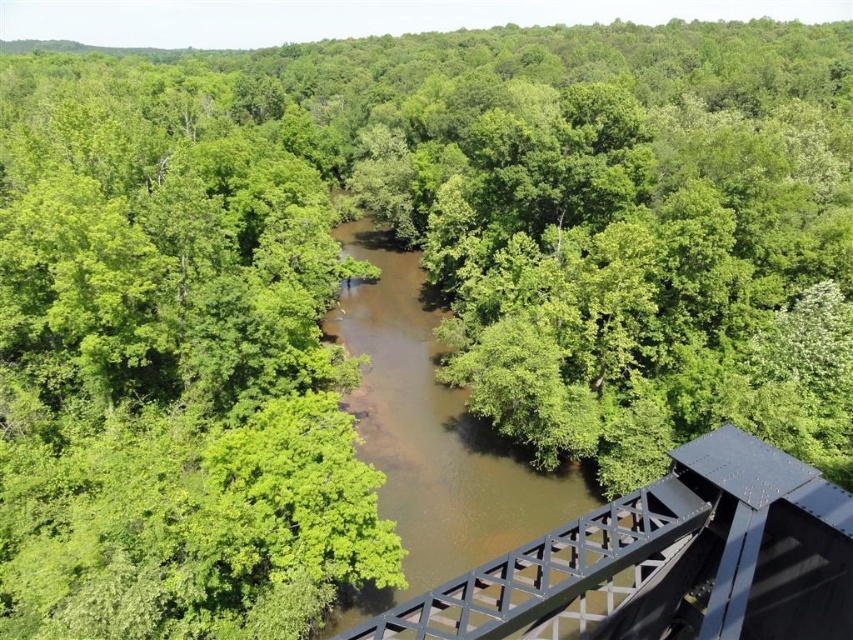
Does black metal train bridge at center have a lesser width compared to brown muddy water at center?

Yes, black metal train bridge at center is thinner than brown muddy water at center.

Between black metal train bridge at center and brown muddy water at center, which one has less height?

black metal train bridge at center is shorter.

This screenshot has height=640, width=853. What do you see at coordinates (665, 561) in the screenshot?
I see `black metal train bridge at center` at bounding box center [665, 561].

Find the location of a particular element. black metal train bridge at center is located at coordinates (665, 561).